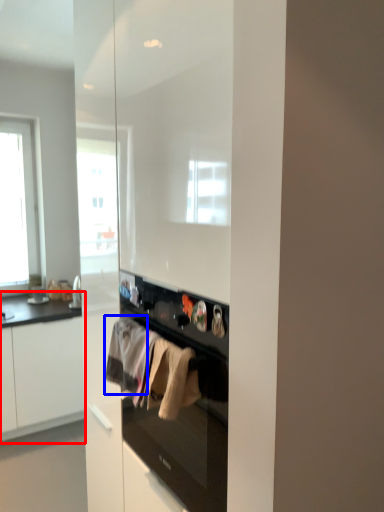
Question: Which of the following is the farthest to the observer, cabinetry (highlighted by a red box) or clothing (highlighted by a blue box)?

Choices:
 (A) cabinetry
 (B) clothing

Answer: (A)